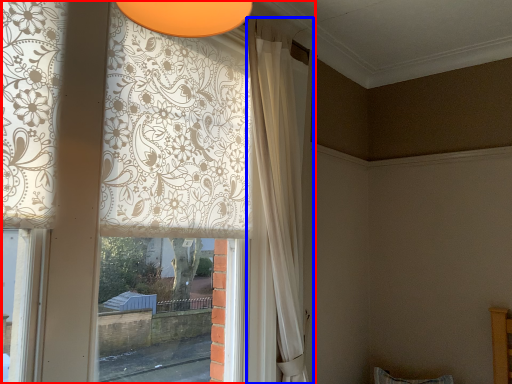
Question: Which object appears farthest to the camera in this image, curtain (highlighted by a red box) or curtain (highlighted by a blue box)?

Choices:
 (A) curtain
 (B) curtain

Answer: (B)